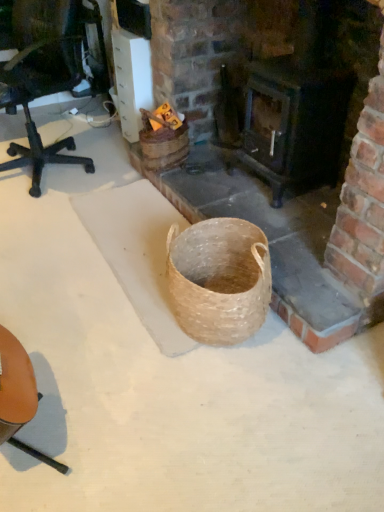
The height and width of the screenshot is (512, 384). In order to click on free space above brick fireplace at center (from a real-world perspective) in this screenshot , I will do `click(254, 198)`.